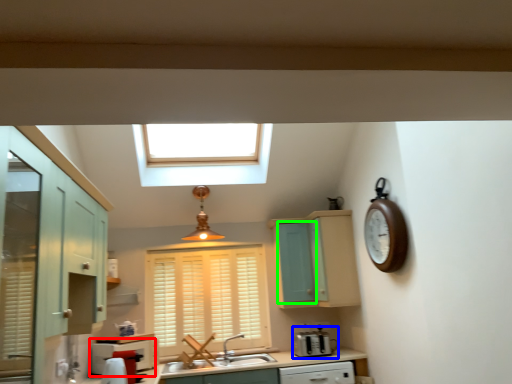
Question: Considering the real-world distances, which object is closest to oven (highlighted by a red box)? appliance (highlighted by a blue box) or screen door (highlighted by a green box).

Choices:
 (A) appliance
 (B) screen door

Answer: (A)